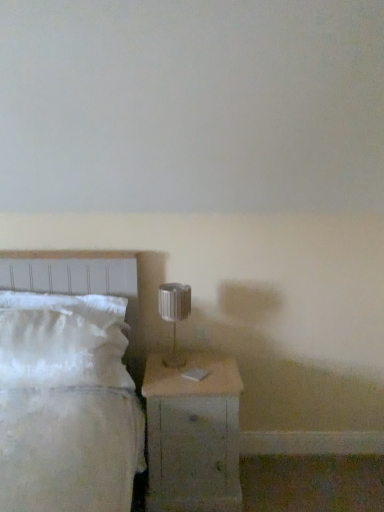
Question: Would you say wooden nightstand at lower right is outside white soft bed at left?

Choices:
 (A) no
 (B) yes

Answer: (B)

Question: From the image's perspective, is wooden nightstand at lower right located above white soft bed at left?

Choices:
 (A) yes
 (B) no

Answer: (B)

Question: Is wooden nightstand at lower right bigger than white soft bed at left?

Choices:
 (A) yes
 (B) no

Answer: (B)

Question: Is wooden nightstand at lower right at the left side of white soft bed at left?

Choices:
 (A) no
 (B) yes

Answer: (A)

Question: Is wooden nightstand at lower right aimed at white soft bed at left?

Choices:
 (A) no
 (B) yes

Answer: (A)

Question: Can you confirm if wooden nightstand at lower right is thinner than white soft bed at left?

Choices:
 (A) no
 (B) yes

Answer: (A)

Question: Is wooden nightstand at lower right at the left side of metallic silver table lamp at center?

Choices:
 (A) no
 (B) yes

Answer: (A)

Question: Considering the relative sizes of wooden nightstand at lower right and metallic silver table lamp at center in the image provided, is wooden nightstand at lower right smaller than metallic silver table lamp at center?

Choices:
 (A) yes
 (B) no

Answer: (B)

Question: Considering the relative positions of wooden nightstand at lower right and metallic silver table lamp at center in the image provided, is wooden nightstand at lower right to the right of metallic silver table lamp at center from the viewer's perspective?

Choices:
 (A) no
 (B) yes

Answer: (B)

Question: Does wooden nightstand at lower right turn towards metallic silver table lamp at center?

Choices:
 (A) no
 (B) yes

Answer: (A)

Question: Is wooden nightstand at lower right positioned with its back to metallic silver table lamp at center?

Choices:
 (A) no
 (B) yes

Answer: (A)

Question: From a real-world perspective, is wooden nightstand at lower right on metallic silver table lamp at center?

Choices:
 (A) no
 (B) yes

Answer: (A)

Question: From the image's perspective, is white soft bed at left located beneath wooden nightstand at lower right?

Choices:
 (A) no
 (B) yes

Answer: (A)